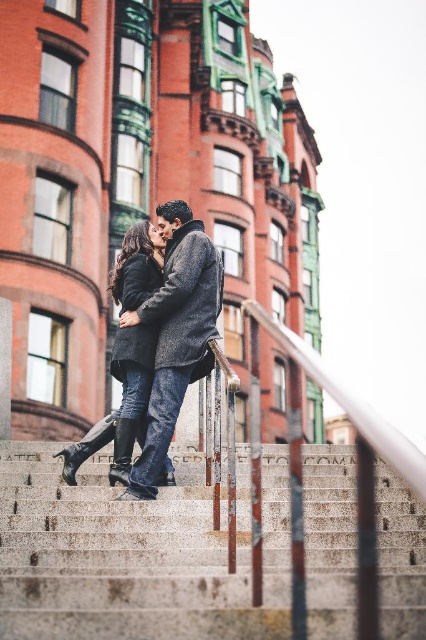
Between concrete stairs at center and velvet black coat at center, which one is positioned lower?

concrete stairs at center is below.

Is concrete stairs at center positioned before velvet black coat at center?

Yes, concrete stairs at center is in front of velvet black coat at center.

Between point (204, 561) and point (154, 330), which one is positioned in front?

Point (204, 561)

I want to click on concrete stairs at center, so click(x=135, y=554).

How far apart are dark gray wool coat at center and velvet black coat at center?

dark gray wool coat at center is 28.33 inches away from velvet black coat at center.

Is dark gray wool coat at center shorter than velvet black coat at center?

No, dark gray wool coat at center is not shorter than velvet black coat at center.

Locate an element on the screen. This screenshot has width=426, height=640. dark gray wool coat at center is located at coordinates (175, 333).

Does concrete stairs at center appear over dark gray wool coat at center?

Actually, concrete stairs at center is below dark gray wool coat at center.

Is concrete stairs at center taller than dark gray wool coat at center?

No, concrete stairs at center is not taller than dark gray wool coat at center.

Image resolution: width=426 pixels, height=640 pixels. Describe the element at coordinates (135, 554) in the screenshot. I see `concrete stairs at center` at that location.

Where is `concrete stairs at center`? This screenshot has width=426, height=640. concrete stairs at center is located at coordinates (135, 554).